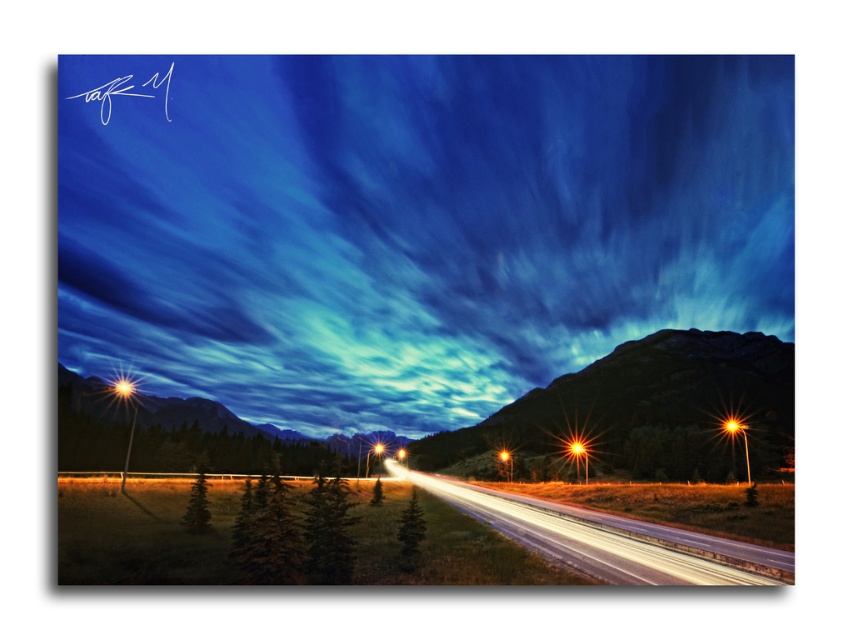
Locate an element on the screen. Image resolution: width=853 pixels, height=640 pixels. bright orange light at right is located at coordinates pyautogui.click(x=732, y=426).

Describe the element at coordinates (732, 426) in the screenshot. This screenshot has height=640, width=853. I see `bright orange light at right` at that location.

At what (x,y) coordinates should I click in order to perform the action: click on bright orange light at right. Please return your answer as a coordinate pair (x, y). Image resolution: width=853 pixels, height=640 pixels. Looking at the image, I should click on (732, 426).

Which of these two, rocky brown mountain at center-right or orange glossy streetlight at center, stands taller?

rocky brown mountain at center-right is taller.

Identify the location of rocky brown mountain at center-right. pyautogui.click(x=641, y=412).

Between point (415, 444) and point (374, 451), which one is positioned in front?

Point (374, 451) is in front.

The width and height of the screenshot is (853, 640). Find the location of `rocky brown mountain at center-right`. rocky brown mountain at center-right is located at coordinates (641, 412).

Between smooth asphalt road at center and white asphalt highway at center, which one appears on the left side from the viewer's perspective?

Positioned to the left is white asphalt highway at center.

Is smooth asphalt road at center wider than white asphalt highway at center?

Yes.

Measure the distance between point [187,445] and camera.

Point [187,445] and camera are 117.87 meters apart from each other.

At what (x,y) coordinates should I click in order to perform the action: click on smooth asphalt road at center. Please return your answer as a coordinate pair (x, y). The height and width of the screenshot is (640, 853). Looking at the image, I should click on (415, 308).